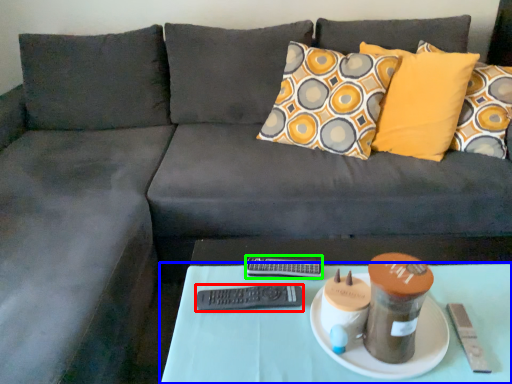
Question: Which object is positioned closest to remote (highlighted by a red box)? Select from table (highlighted by a blue box) and remote (highlighted by a green box).

Choices:
 (A) table
 (B) remote

Answer: (B)